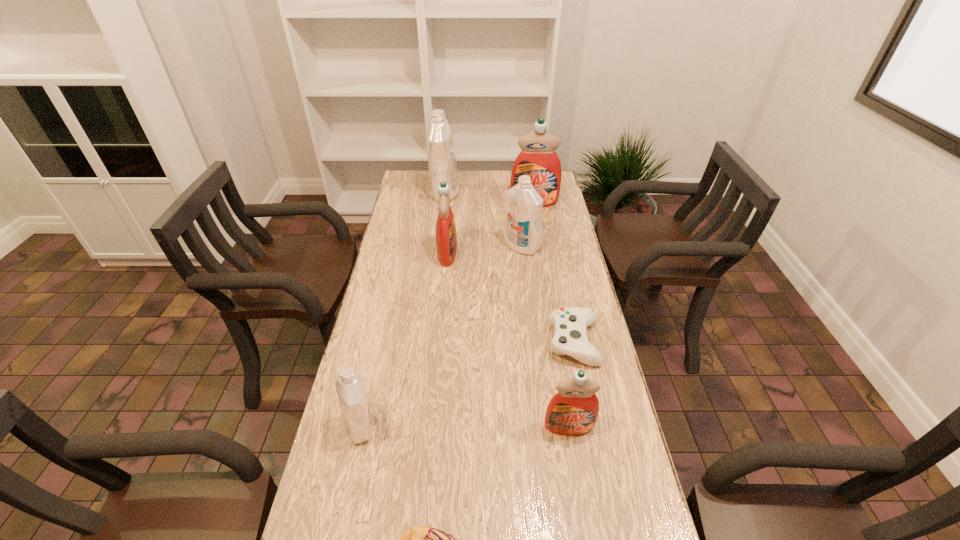
In order to click on control located at the right edge in this screenshot , I will do pyautogui.click(x=570, y=324).

Where is `object present at the far left corner`? object present at the far left corner is located at coordinates (441, 149).

Identify the location of free space at the left edge of the desktop. The width and height of the screenshot is (960, 540). (374, 282).

Find the location of `blank space at the right edge of the desktop`. blank space at the right edge of the desktop is located at coordinates (586, 520).

Find the location of a particular element. vacant space that is in between the leftmost white detergent and the second biggest red detergent is located at coordinates (404, 340).

Where is `unoccupied position between the farthest white detergent and the leftmost detergent`? This screenshot has width=960, height=540. unoccupied position between the farthest white detergent and the leftmost detergent is located at coordinates (403, 310).

Identify the location of vacant area between the farthest red detergent and the white control. (554, 273).

Locate an element on the screen. This screenshot has width=960, height=540. free space between the farthest red detergent and the second nearest red detergent is located at coordinates (491, 228).

This screenshot has height=540, width=960. What are the coordinates of `unoccupied position between the biggest white detergent and the fifth farthest object` in the screenshot? It's located at (510, 268).

You are a GUI agent. You are given a task and a screenshot of the screen. Output one action in this format:
    pyautogui.click(x=<x>, y=<y>)
    Task: Click on the vacant region between the leftmost red detergent and the rightmost white detergent
    The image size is (960, 540).
    Given the screenshot: What is the action you would take?
    pyautogui.click(x=485, y=250)